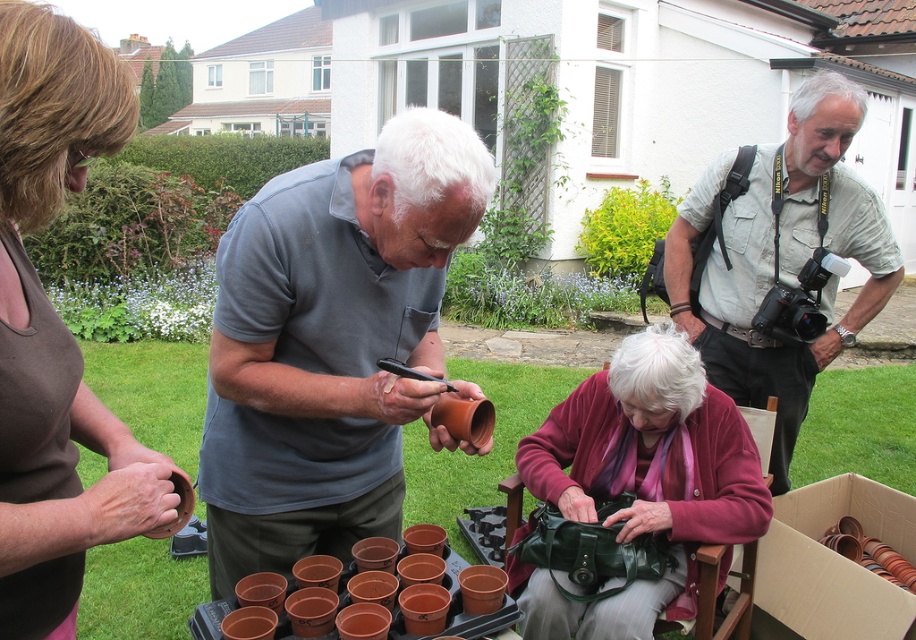
You are standing at the starting point and need to reach the destination point. The starting point is at point (613, 468) and the destination is at point (797, 579). According to the scene description, which direction should you move to get from the starting point to the destination?

To move from point (613, 468) to point (797, 579), you should move towards the upper right direction since the destination point is located at a higher coordinate both in the x and y axes compared to the starting point.

In the scene shown: You are standing at the point labeled as point (456,589) and want to walk to the house in the background. Is the point labeled as point (750,353) in your path?

Yes, the point labeled as point (750,353) is behind point (456,589), so it is in your path towards the house.

You are a photographer trying to capture a photo of the brown matte tank top at upper left and the brown cardboard box at lower right. Since you want both objects to appear equally sized in the photo, which object should you move closer to the camera?

The brown cardboard box at lower right should be moved closer to the camera because it is shorter than the brown matte tank top at upper left. To make them appear the same size in the photo, the shorter object needs to be positioned nearer to the camera.